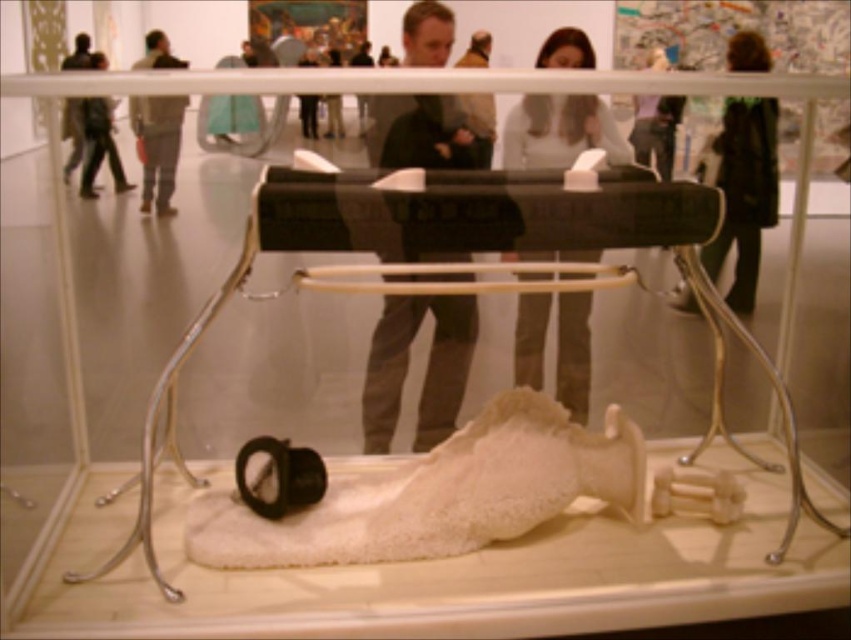
Does dark brown leather jacket at upper right have a greater height compared to gray fabric jacket at upper left?

Correct, dark brown leather jacket at upper right is much taller as gray fabric jacket at upper left.

Is point (774, 115) farther from viewer compared to point (155, 179)?

Yes.

Is point (757, 100) positioned behind point (166, 177)?

Yes.

Locate an element on the screen. Image resolution: width=851 pixels, height=640 pixels. dark brown leather jacket at upper right is located at coordinates click(x=744, y=193).

Between dark gray fabric jacket at center and dark brown leather jacket at upper right, which one appears on the left side from the viewer's perspective?

From the viewer's perspective, dark gray fabric jacket at center appears more on the left side.

Is dark gray fabric jacket at center smaller than dark brown leather jacket at upper right?

No.

Locate an element on the screen. dark gray fabric jacket at center is located at coordinates pos(426,371).

Does dark gray fabric jacket at center appear on the left side of matte black laptop at upper center?

Indeed, dark gray fabric jacket at center is positioned on the left side of matte black laptop at upper center.

Is point (431, 419) closer to camera compared to point (570, 61)?

No, it is not.

Which is behind, point (397, 353) or point (574, 394)?

The point (574, 394) is behind.

I want to click on dark gray fabric jacket at center, so pos(426,371).